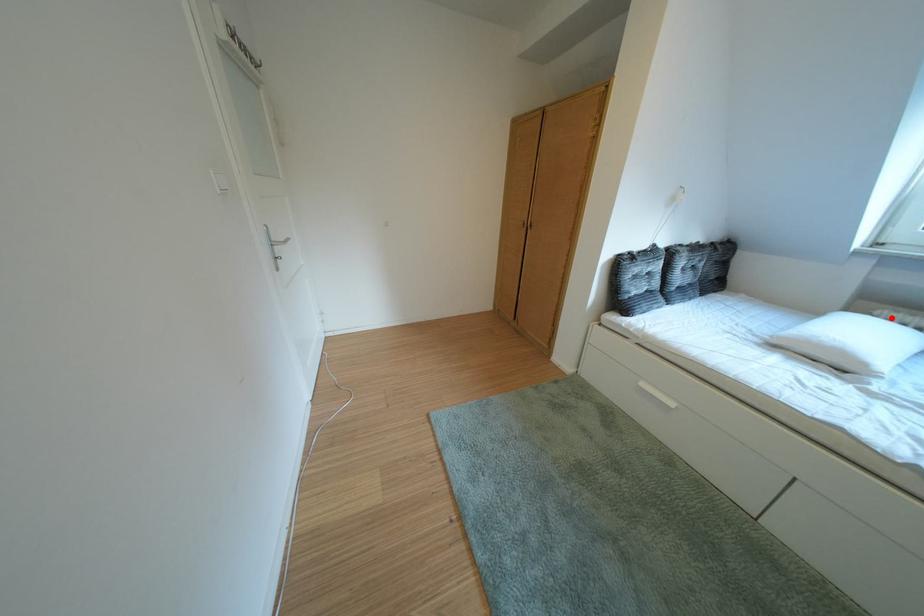
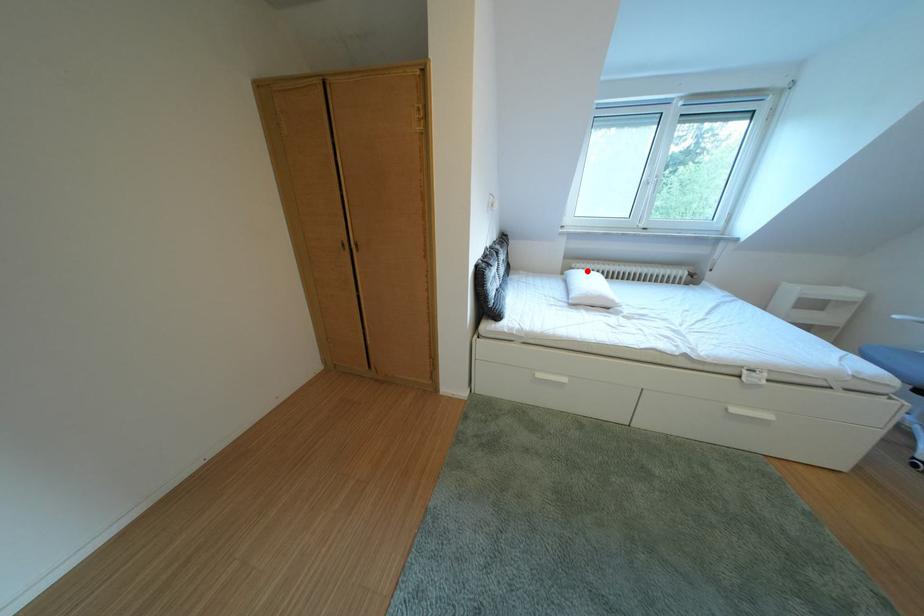
I am providing you with two images of the same scene from different viewpoints. A red point is marked on the first image and another point is marked on the second image. Is the marked point in image1 the same physical position as the marked point in image2?

Yes